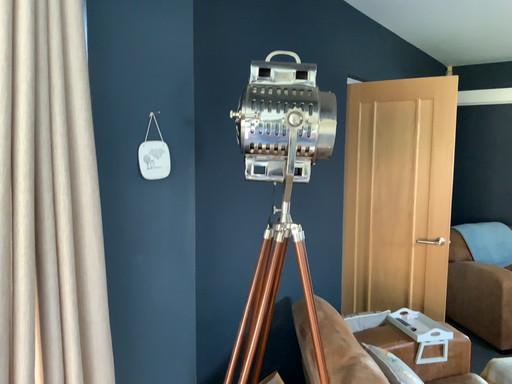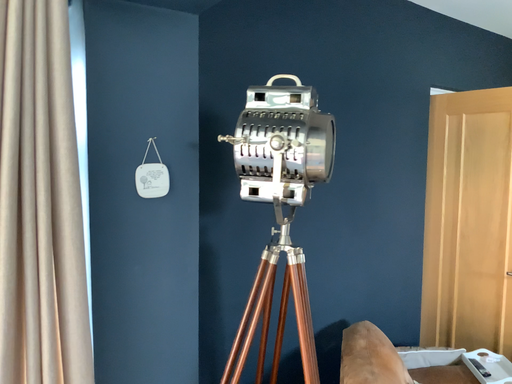
Question: How did the camera likely rotate when shooting the video?

Choices:
 (A) rotated left
 (B) rotated right

Answer: (A)